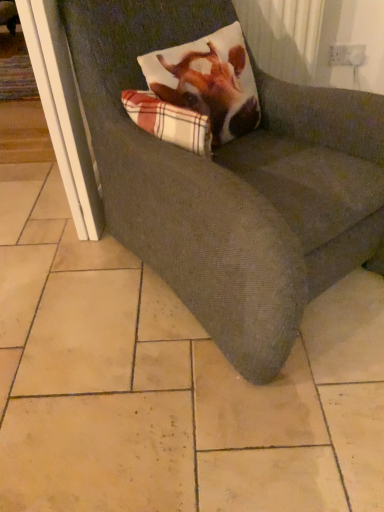
Question: Is plaid fabric pillow at upper center wider or thinner than white plastic screen door at left?

Choices:
 (A) thin
 (B) wide

Answer: (A)

Question: In the image, is plaid fabric pillow at upper center on the left side or the right side of white plastic screen door at left?

Choices:
 (A) right
 (B) left

Answer: (A)

Question: Estimate the real-world distances between objects in this image. Which object is farther from the plaid fabric pillow at upper center?

Choices:
 (A) white plastic screen door at left
 (B) textured gray couch at center

Answer: (A)

Question: Which is nearer to the plaid fabric pillow at upper center?

Choices:
 (A) white plastic screen door at left
 (B) textured gray couch at center

Answer: (B)